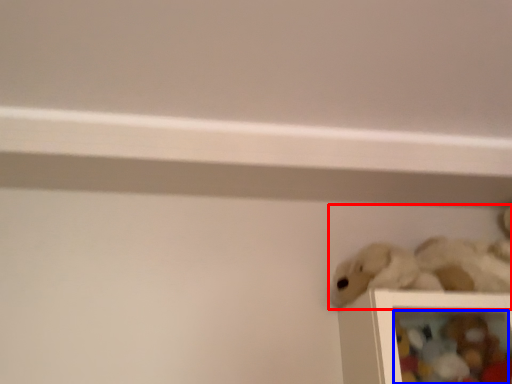
Question: Which object is closer to the camera taking this photo, toy (highlighted by a red box) or toy (highlighted by a blue box)?

Choices:
 (A) toy
 (B) toy

Answer: (A)